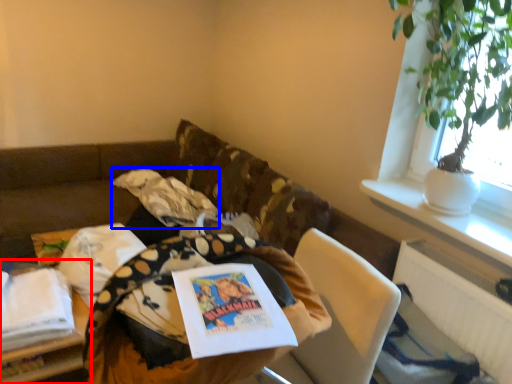
Question: Among these objects, which one is nearest to the camera, table (highlighted by a red box) or material (highlighted by a blue box)?

Choices:
 (A) table
 (B) material

Answer: (A)